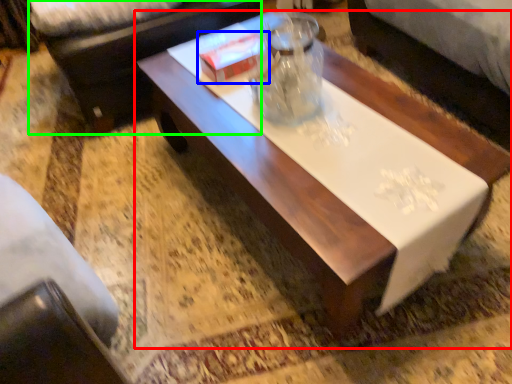
Question: Considering the real-world distances, which object is farthest from coffee table (highlighted by a red box)? box (highlighted by a blue box) or couch (highlighted by a green box)?

Choices:
 (A) box
 (B) couch

Answer: (B)